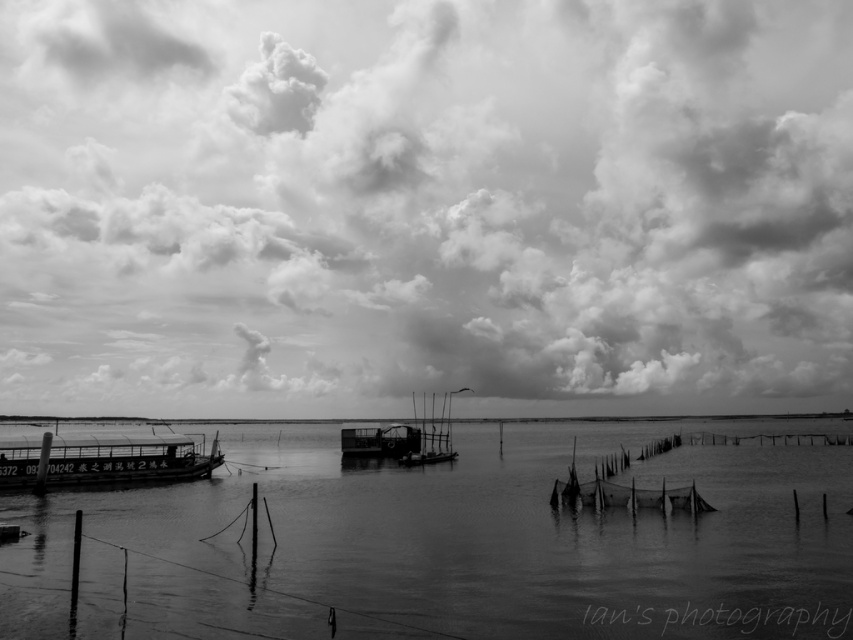
Question: Which point is farther to the camera?

Choices:
 (A) (759, 224)
 (B) (677, 481)

Answer: (A)

Question: Can you confirm if cloudy sky at upper center is positioned below metallic boat at center?

Choices:
 (A) no
 (B) yes

Answer: (A)

Question: Among these objects, which one is nearest to the camera?

Choices:
 (A) metallic boat at center
 (B) cloudy sky at upper center
 (C) metallic boat at lower left
 (D) smooth water at center

Answer: (D)

Question: Is cloudy sky at upper center smaller than smooth water at center?

Choices:
 (A) yes
 (B) no

Answer: (B)

Question: Estimate the real-world distances between objects in this image. Which object is farther from the metallic boat at center?

Choices:
 (A) smooth water at center
 (B) cloudy sky at upper center

Answer: (B)

Question: Can you confirm if metallic boat at lower left is wider than metallic boat at center?

Choices:
 (A) yes
 (B) no

Answer: (A)